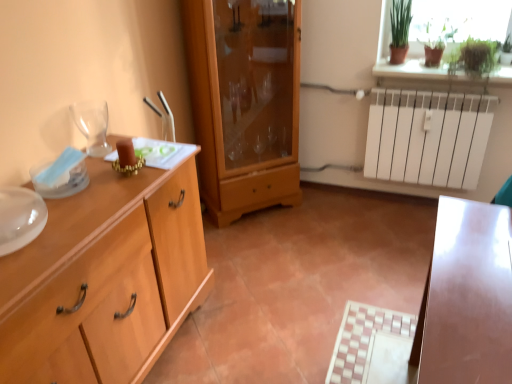
Identify the location of free space to the right of wooden cabinet at center. This screenshot has width=512, height=384. (330, 215).